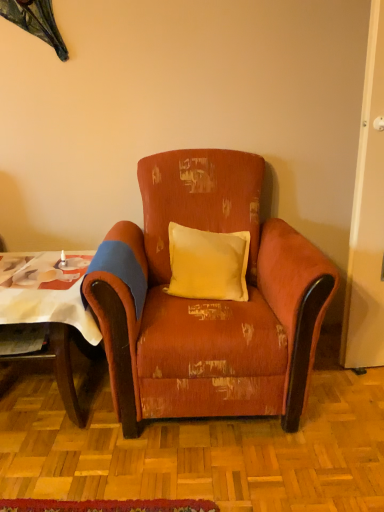
The image size is (384, 512). What do you see at coordinates (209, 301) in the screenshot?
I see `distressed orange fabric armchair at center` at bounding box center [209, 301].

The image size is (384, 512). Describe the element at coordinates (50, 313) in the screenshot. I see `wooden table at left` at that location.

This screenshot has width=384, height=512. I want to click on distressed orange fabric armchair at center, so click(209, 301).

In the image, is wooden table at left positioned in front of or behind distressed orange fabric armchair at center?

Clearly, wooden table at left is behind distressed orange fabric armchair at center.

Would you say wooden table at left is outside distressed orange fabric armchair at center?

Yes, wooden table at left is outside of distressed orange fabric armchair at center.

At what (x,y) coordinates should I click in order to perform the action: click on table lying below the distressed orange fabric armchair at center (from the image's perspective). Please return your answer as a coordinate pair (x, y). The height and width of the screenshot is (512, 384). Looking at the image, I should click on (50, 313).

Would you say distressed orange fabric armchair at center is a long distance from wooden table at left?

Actually, distressed orange fabric armchair at center and wooden table at left are a little close together.

Image resolution: width=384 pixels, height=512 pixels. What are the coordinates of `chair that appears above the wooden table at left (from a real-world perspective)` in the screenshot? It's located at (209, 301).

Does distressed orange fabric armchair at center have a larger size compared to wooden table at left?

Yes, distressed orange fabric armchair at center is bigger than wooden table at left.

In terms of width, does distressed orange fabric armchair at center look wider or thinner when compared to wooden table at left?

Considering their sizes, distressed orange fabric armchair at center looks broader than wooden table at left.

Locate an element on the screen. pillow to the right of wooden table at left is located at coordinates (208, 264).

From the image's perspective, is yellow fabric pillow at center beneath wooden table at left?

No, from the image's perspective, yellow fabric pillow at center is not below wooden table at left.

From a real-world perspective, relative to wooden table at left, is yellow fabric pillow at center vertically above or below?

yellow fabric pillow at center is above wooden table at left.

Is yellow fabric pillow at center thinner than wooden table at left?

Indeed, yellow fabric pillow at center has a lesser width compared to wooden table at left.

Based on the photo, does yellow fabric pillow at center appear on the left side of distressed orange fabric armchair at center?

Incorrect, yellow fabric pillow at center is not on the left side of distressed orange fabric armchair at center.

There is a distressed orange fabric armchair at center. Identify the location of pillow above it (from a real-world perspective). Image resolution: width=384 pixels, height=512 pixels. (208, 264).

Is yellow fabric pillow at center turned away from distressed orange fabric armchair at center?

Absolutely, yellow fabric pillow at center is directed away from distressed orange fabric armchair at center.

Is point (225, 234) positioned after point (203, 319)?

Yes, it is.

Is wooden table at left situated inside yellow fabric pillow at center or outside?

wooden table at left cannot be found inside yellow fabric pillow at center.

In terms of width, does wooden table at left look wider or thinner when compared to yellow fabric pillow at center?

In the image, wooden table at left appears to be wider than yellow fabric pillow at center.

Could you tell me if wooden table at left is facing yellow fabric pillow at center?

No, wooden table at left does not turn towards yellow fabric pillow at center.

From the image's perspective, who appears lower, wooden table at left or yellow fabric pillow at center?

wooden table at left.

The height and width of the screenshot is (512, 384). In order to click on chair in front of the yellow fabric pillow at center in this screenshot , I will do `click(209, 301)`.

Does distressed orange fabric armchair at center turn towards yellow fabric pillow at center?

Yes, distressed orange fabric armchair at center is turned towards yellow fabric pillow at center.

From a real-world perspective, which is physically below, distressed orange fabric armchair at center or yellow fabric pillow at center?

distressed orange fabric armchair at center is physically lower.

Can you confirm if distressed orange fabric armchair at center is shorter than yellow fabric pillow at center?

No, distressed orange fabric armchair at center is not shorter than yellow fabric pillow at center.

You are a GUI agent. You are given a task and a screenshot of the screen. Output one action in this format:
    pyautogui.click(x=<x>, y=<y>)
    Task: Click on the table that is behind the distressed orange fabric armchair at center
    
    Given the screenshot: What is the action you would take?
    pyautogui.click(x=50, y=313)

I want to click on table located below the distressed orange fabric armchair at center (from the image's perspective), so click(50, 313).

Estimate the real-world distances between objects in this image. Which object is closer to yellow fabric pillow at center, wooden table at left or distressed orange fabric armchair at center?

distressed orange fabric armchair at center is positioned closer to the anchor yellow fabric pillow at center.

Considering their positions, is distressed orange fabric armchair at center positioned closer to wooden table at left than yellow fabric pillow at center?

Based on the image, distressed orange fabric armchair at center appears to be nearer to wooden table at left.

Considering their positions, is yellow fabric pillow at center positioned further to wooden table at left than distressed orange fabric armchair at center?

Among the two, yellow fabric pillow at center is located further to wooden table at left.

Estimate the real-world distances between objects in this image. Which object is closer to distressed orange fabric armchair at center, wooden table at left or yellow fabric pillow at center?

The object closer to distressed orange fabric armchair at center is yellow fabric pillow at center.

In the scene shown: Looking at the image, which one is located closer to yellow fabric pillow at center, distressed orange fabric armchair at center or wooden table at left?

distressed orange fabric armchair at center.

Which object lies nearer to the anchor point distressed orange fabric armchair at center, yellow fabric pillow at center or wooden table at left?

yellow fabric pillow at center is positioned closer to the anchor distressed orange fabric armchair at center.

Identify the location of chair located between wooden table at left and yellow fabric pillow at center in the left-right direction. (209, 301).